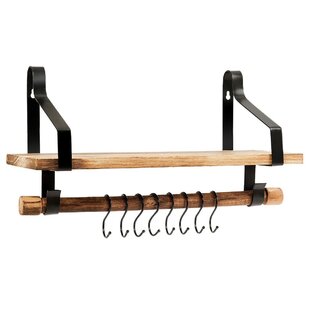
Where is `8th black hook`? The width and height of the screenshot is (310, 310). 8th black hook is located at coordinates (195, 229).